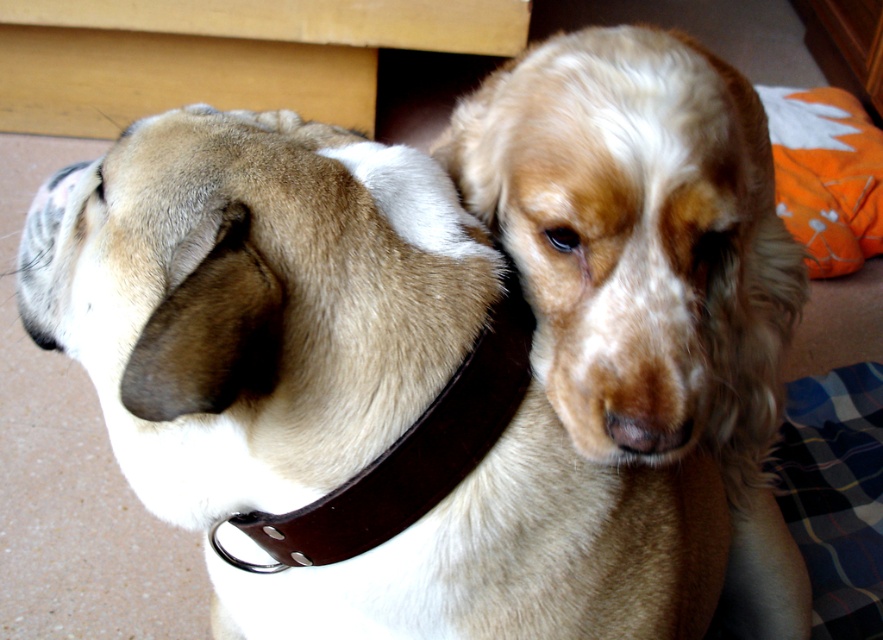
Does golden fur dog at center have a smaller size compared to brown leather neckband at left?

No.

Which is behind, point (608, 444) or point (389, 508)?

Positioned behind is point (608, 444).

Locate an element on the screen. The image size is (883, 640). golden fur dog at center is located at coordinates (638, 241).

Is brown leather collar at upper center wider than golden fur dog at center?

Indeed, brown leather collar at upper center has a greater width compared to golden fur dog at center.

Can you confirm if brown leather collar at upper center is bigger than golden fur dog at center?

Correct, brown leather collar at upper center is larger in size than golden fur dog at center.

Locate an element on the screen. The width and height of the screenshot is (883, 640). brown leather collar at upper center is located at coordinates (338, 385).

Find the location of `brown leather collar at upper center`. brown leather collar at upper center is located at coordinates (338, 385).

Is brown leather collar at upper center thinner than brown leather neckband at left?

No.

Is brown leather collar at upper center taller than brown leather neckband at left?

Yes, brown leather collar at upper center is taller than brown leather neckband at left.

You are a GUI agent. You are given a task and a screenshot of the screen. Output one action in this format:
    pyautogui.click(x=<x>, y=<y>)
    Task: Click on the brown leather collar at upper center
    This screenshot has height=640, width=883.
    Given the screenshot: What is the action you would take?
    pyautogui.click(x=338, y=385)